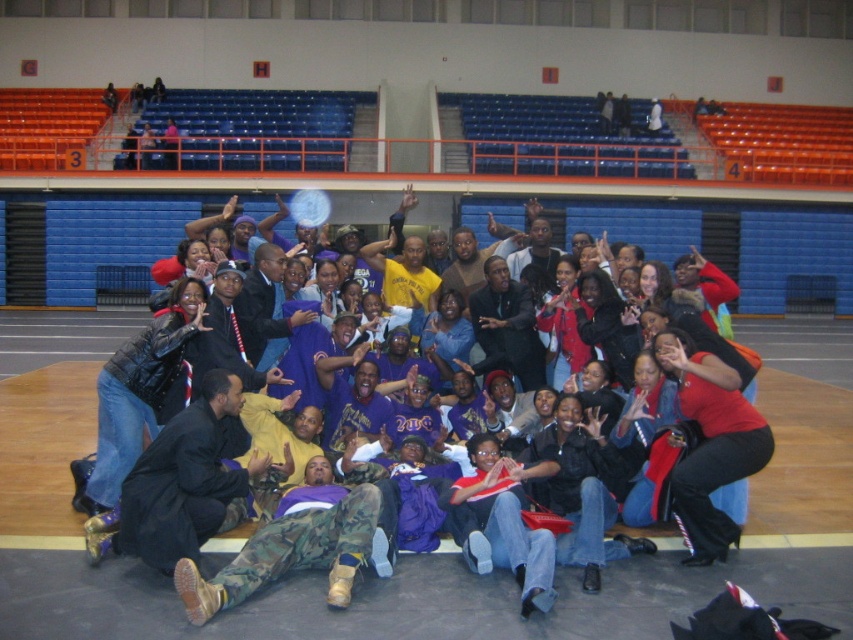
Can you confirm if black matte jacket at lower left is bigger than dark suit at center?

Indeed, black matte jacket at lower left has a larger size compared to dark suit at center.

Where is `black matte jacket at lower left`? black matte jacket at lower left is located at coordinates (184, 481).

Image resolution: width=853 pixels, height=640 pixels. What are the coordinates of `black matte jacket at lower left` in the screenshot? It's located at (184, 481).

Between purple matte t-shirt at center and black matte jacket at lower left, which one is positioned higher?

purple matte t-shirt at center

Which is in front, point (186, 560) or point (199, 429)?

Point (186, 560)

Locate an element on the screen. purple matte t-shirt at center is located at coordinates pos(605,456).

Between point (175, 516) and point (383, 268), which one is positioned behind?

The point (383, 268) is more distant.

From the picture: Is black matte jacket at lower left positioned behind matte yellow t-shirt at center?

No, it is not.

Is point (132, 548) positioned before point (421, 284)?

Yes, it is in front of point (421, 284).

You are a GUI agent. You are given a task and a screenshot of the screen. Output one action in this format:
    pyautogui.click(x=<x>, y=<y>)
    Task: Click on the black matte jacket at lower left
    The width and height of the screenshot is (853, 640).
    Given the screenshot: What is the action you would take?
    (x=184, y=481)